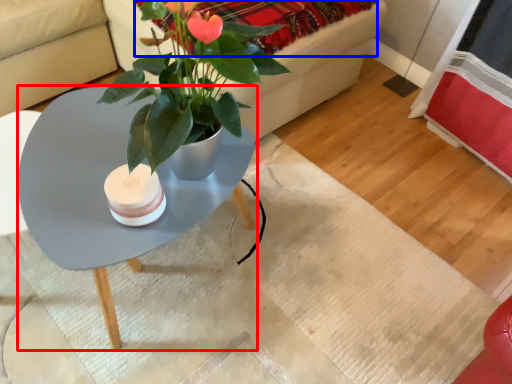
Question: Among these objects, which one is farthest to the camera, coffee table (highlighted by a red box) or blanket (highlighted by a blue box)?

Choices:
 (A) coffee table
 (B) blanket

Answer: (B)